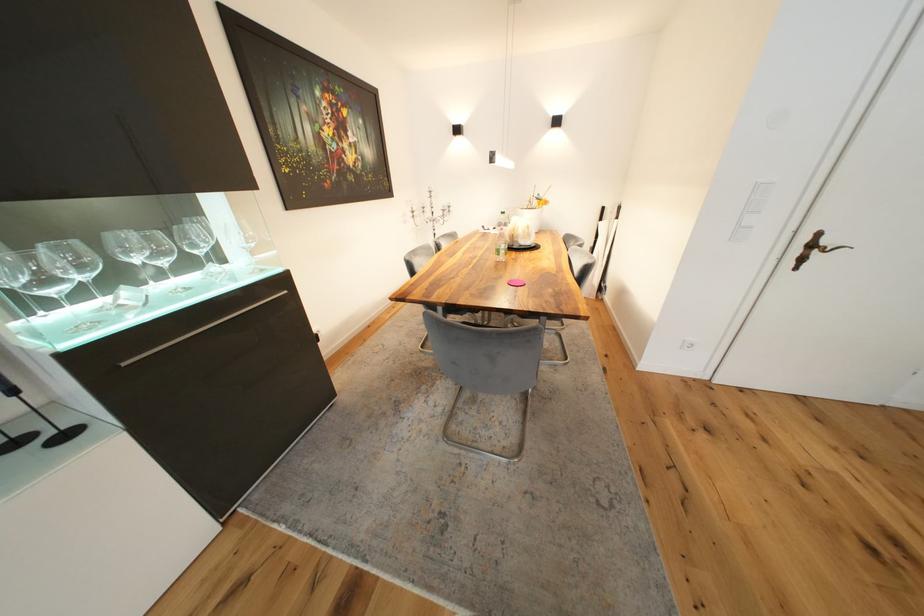
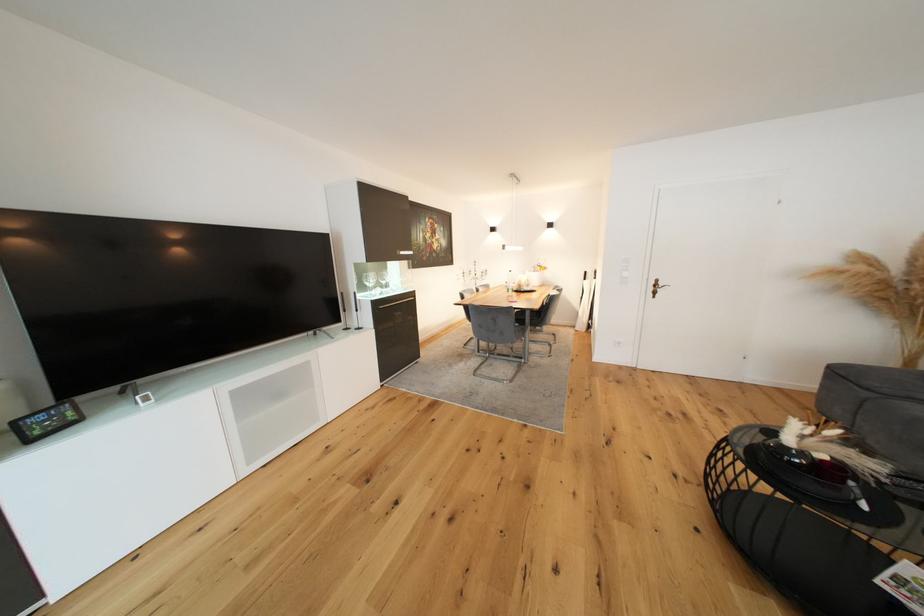
Where in the second image is the point corresponding to (x=832, y=244) from the first image?

(667, 286)